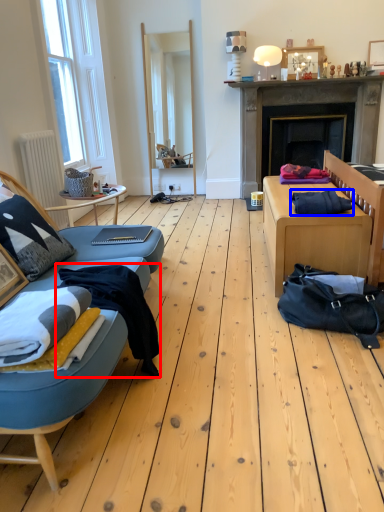
Question: Among these objects, which one is farthest to the camera, clothing (highlighted by a red box) or clothing (highlighted by a blue box)?

Choices:
 (A) clothing
 (B) clothing

Answer: (B)